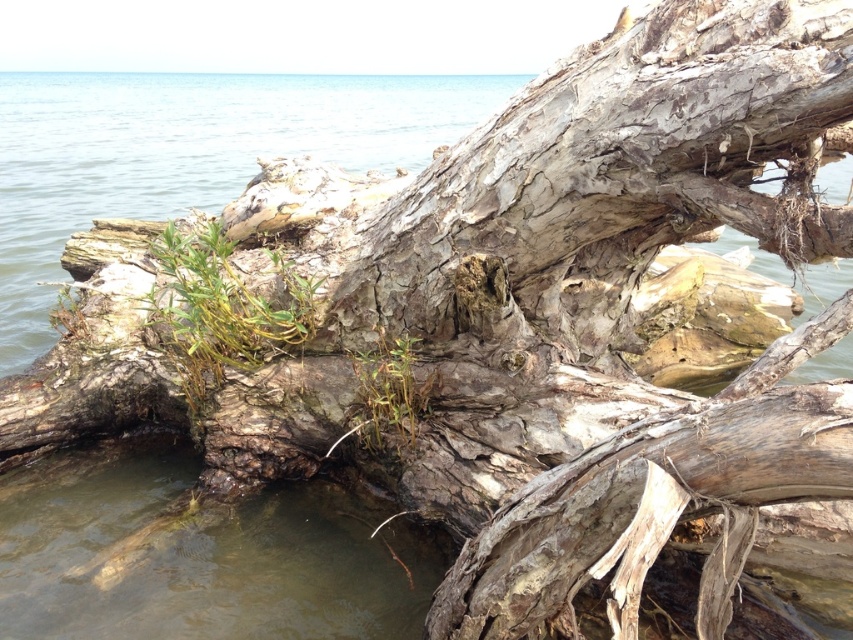
You are a hiker who wants to cross the area shown in the image. You have to avoid getting your shoes wet. Which object should you step on to stay dry? The clear water at lower left or the green grassy plant at center?

The clear water at lower left is much taller than the green grassy plant at center, so stepping on the green grassy plant at center would keep you dry as it is higher and out of the water.

You are a gardener who wants to trim the green grassy plant at center and the green grassy weed at center. Which one should you cut first to avoid blocking the view of the other?

You should cut the green grassy plant at center first because it is taller than the green grassy weed at center, so trimming it first will prevent it from obstructing the view of the shorter weed.